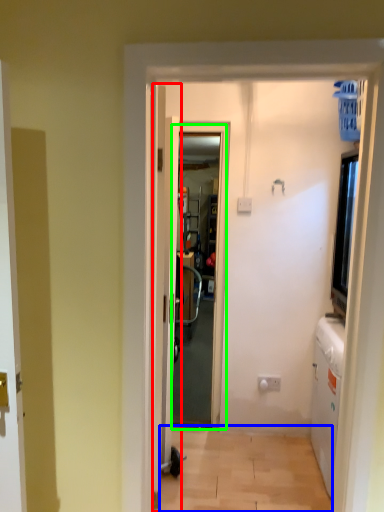
Question: Which object is the farthest from door (highlighted by a red box)? Choose among these: corridor (highlighted by a blue box) or screen door (highlighted by a green box).

Choices:
 (A) corridor
 (B) screen door

Answer: (A)